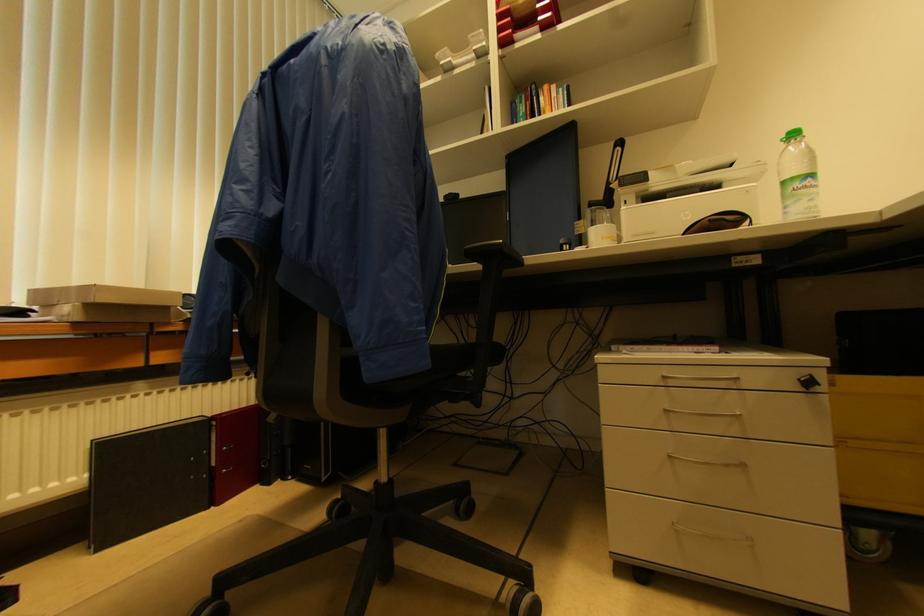
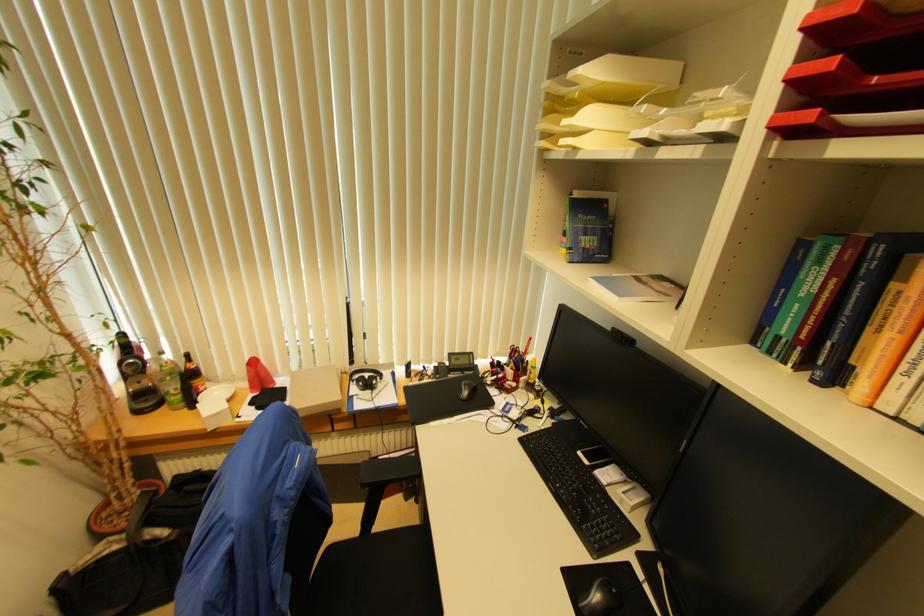
Where in the second image is the point corresponding to the point at 523,105 from the first image?

(821, 265)